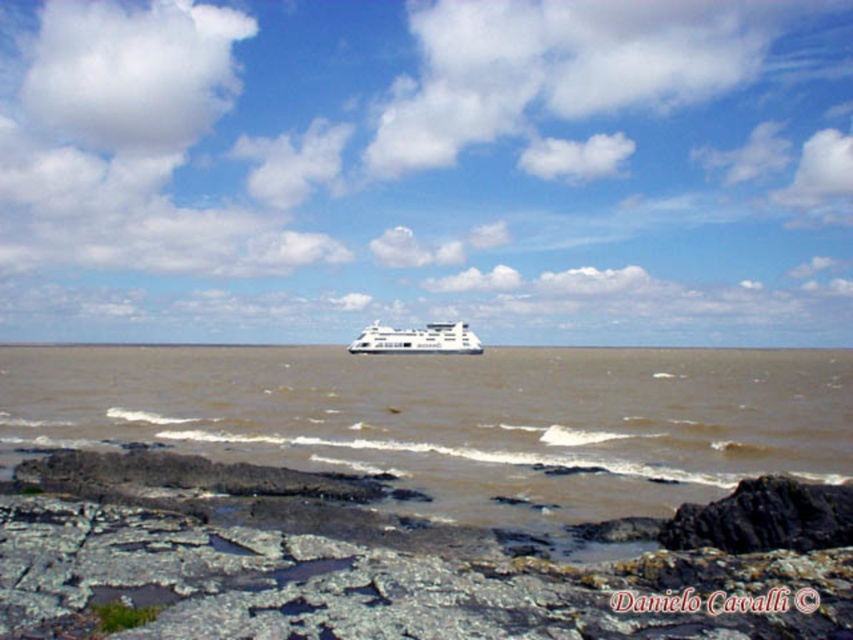
In the scene shown: You are a photographer aiming to capture the white glossy cruise ship at center and the brown matte water at center in a single frame. Based on their positions, which object would appear closer to the right edge of your photo?

The brown matte water at center is positioned on the right side of the white glossy cruise ship at center, so it would appear closer to the right edge of the photo.